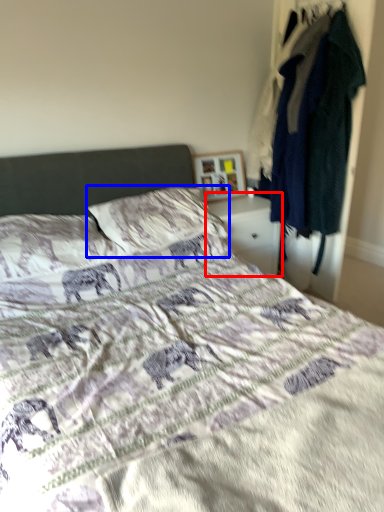
Question: Which object is closer to the camera taking this photo, nightstand (highlighted by a red box) or pillow (highlighted by a blue box)?

Choices:
 (A) nightstand
 (B) pillow

Answer: (B)